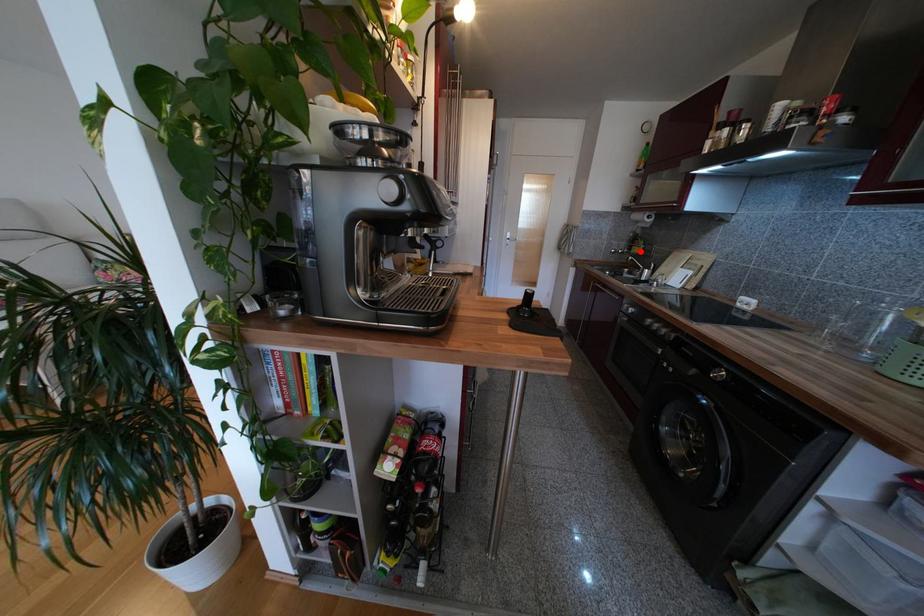
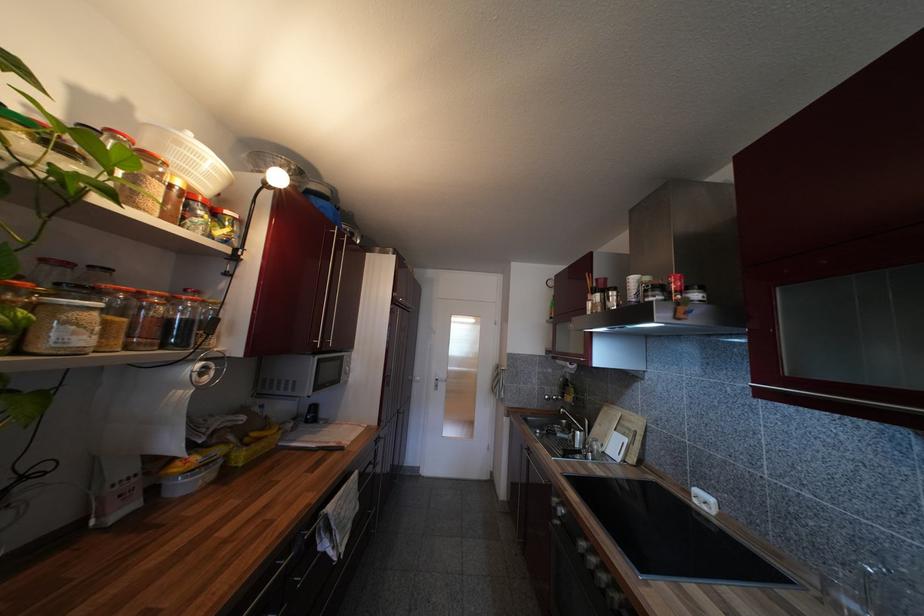
Question: I am providing you with two images of the same scene from different viewpoints. In image1, a red point is highlighted. Considering the same 3D point in image2, which of the following is correct?

Choices:
 (A) It is closer
 (B) It is farther

Answer: (B)